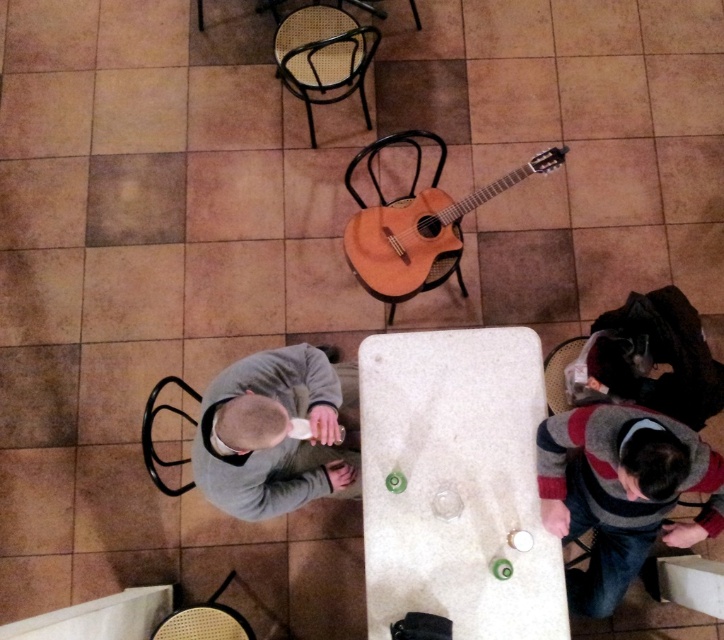
Question: Which object is closer to the camera taking this photo?

Choices:
 (A) striped sweater at lower right
 (B) light brown wood guitar at center

Answer: (A)

Question: Which point is closer to the camera?

Choices:
 (A) rattan chair at lower left
 (B) metallic mesh chair at upper center
 (C) gray matte sweater at lower left

Answer: (C)

Question: Is white marble table at center closer to the viewer compared to light brown wood guitar at center?

Choices:
 (A) yes
 (B) no

Answer: (A)

Question: Observing the image, what is the correct spatial positioning of gray matte sweater at lower left in reference to metallic mesh chair at upper center?

Choices:
 (A) above
 (B) below

Answer: (B)

Question: Among these points, which one is farthest from the camera?

Choices:
 (A) (201, 3)
 (B) (489, 378)
 (C) (657, 476)

Answer: (A)

Question: Does gray matte sweater at lower left come in front of metallic mesh chair at upper center?

Choices:
 (A) no
 (B) yes

Answer: (B)